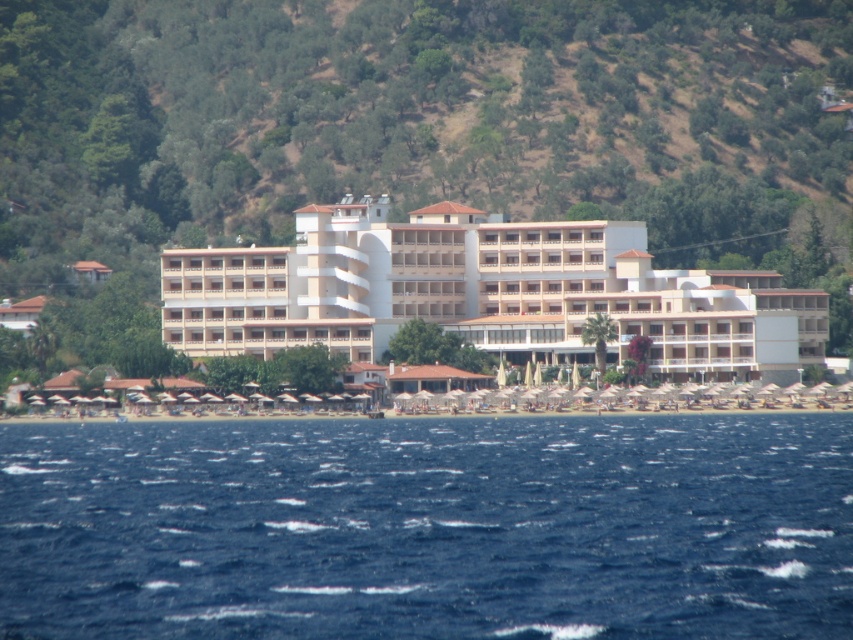
Does blue water at lower center have a lesser height compared to white matte building at center?

Yes, blue water at lower center is shorter than white matte building at center.

Between blue water at lower center and white matte building at center, which one has more height?

Standing taller between the two is white matte building at center.

Does point (553, 534) come behind point (634, 305)?

No, it is not.

Where is `blue water at lower center`? The height and width of the screenshot is (640, 853). blue water at lower center is located at coordinates (428, 528).